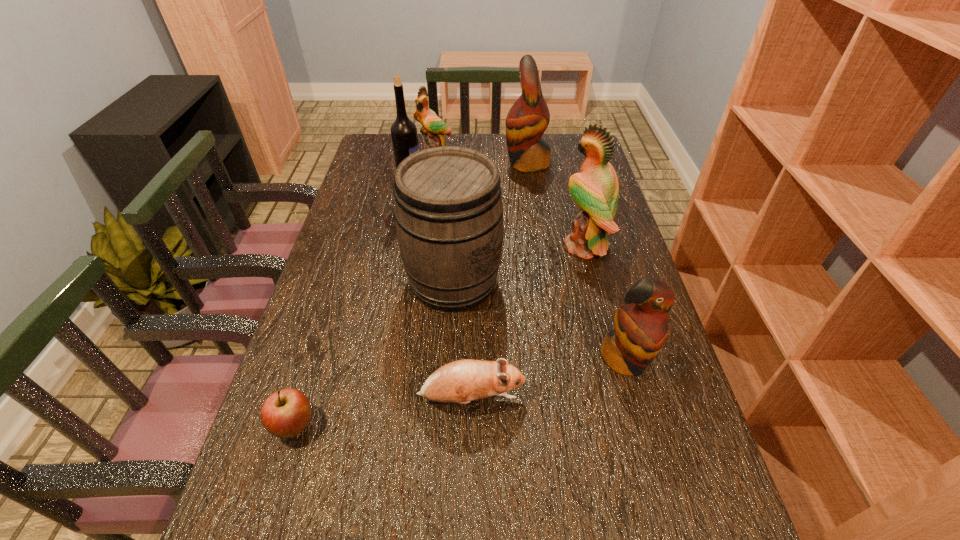
Locate an element on the screen. This screenshot has width=960, height=540. wine bottle is located at coordinates (404, 135).

The image size is (960, 540). I want to click on the seventh nearest object, so click(x=404, y=135).

The image size is (960, 540). I want to click on the farther red parrot, so click(528, 118).

The height and width of the screenshot is (540, 960). What are the coordinates of `the left red parrot` in the screenshot? It's located at (528, 118).

Identify the location of the nearer green parrot. This screenshot has width=960, height=540. (595, 190).

The width and height of the screenshot is (960, 540). Find the location of `the bigger green parrot`. the bigger green parrot is located at coordinates (595, 190).

Find the location of a particular element. The width and height of the screenshot is (960, 540). wine bucket is located at coordinates (448, 210).

At what (x,y) coordinates should I click in order to perform the action: click on the left green parrot. Please return your answer as a coordinate pair (x, y). This screenshot has width=960, height=540. Looking at the image, I should click on (433, 127).

This screenshot has height=540, width=960. I want to click on the farther green parrot, so click(x=433, y=127).

At what (x,y) coordinates should I click in order to perform the action: click on the nearest parrot. Please return your answer as a coordinate pair (x, y). The height and width of the screenshot is (540, 960). Looking at the image, I should click on (640, 331).